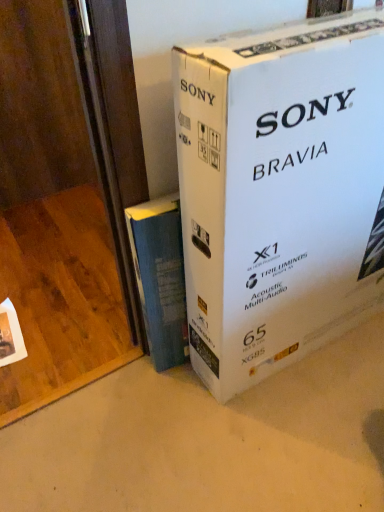
Question: Is white cardboard box at center behind blue fabric book at lower left?

Choices:
 (A) yes
 (B) no

Answer: (B)

Question: Can blue fabric book at lower left be found inside white cardboard box at center?

Choices:
 (A) no
 (B) yes

Answer: (A)

Question: Is the position of white cardboard box at center less distant than that of blue fabric book at lower left?

Choices:
 (A) no
 (B) yes

Answer: (B)

Question: Does white cardboard box at center appear on the right side of blue fabric book at lower left?

Choices:
 (A) yes
 (B) no

Answer: (A)

Question: Is there a large distance between white cardboard box at center and blue fabric book at lower left?

Choices:
 (A) yes
 (B) no

Answer: (B)

Question: From the image's perspective, does white cardboard box at center appear higher than blue fabric book at lower left?

Choices:
 (A) no
 (B) yes

Answer: (B)

Question: Is blue fabric book at lower left turned away from white cardboard box at center?

Choices:
 (A) no
 (B) yes

Answer: (A)

Question: Can you confirm if blue fabric book at lower left is smaller than white cardboard box at center?

Choices:
 (A) no
 (B) yes

Answer: (B)

Question: Is blue fabric book at lower left aimed at white cardboard box at center?

Choices:
 (A) no
 (B) yes

Answer: (A)

Question: Is white cardboard box at center surrounded by blue fabric book at lower left?

Choices:
 (A) yes
 (B) no

Answer: (B)

Question: From the image's perspective, is blue fabric book at lower left located above white cardboard box at center?

Choices:
 (A) no
 (B) yes

Answer: (A)

Question: Is blue fabric book at lower left to the left of white cardboard box at center from the viewer's perspective?

Choices:
 (A) no
 (B) yes

Answer: (B)

Question: Is point (157, 234) positioned closer to the camera than point (266, 103)?

Choices:
 (A) farther
 (B) closer

Answer: (A)